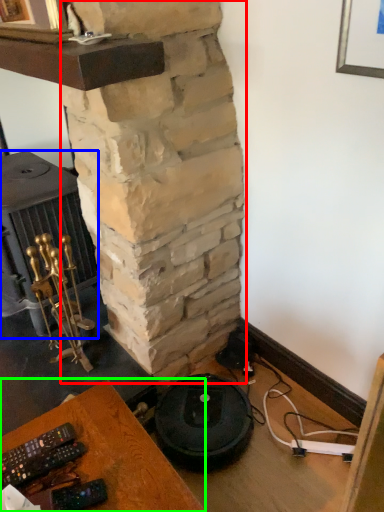
Question: Considering the real-world distances, which object is farthest from pillar (highlighted by a red box)? stove (highlighted by a blue box) or furniture (highlighted by a green box)?

Choices:
 (A) stove
 (B) furniture

Answer: (B)